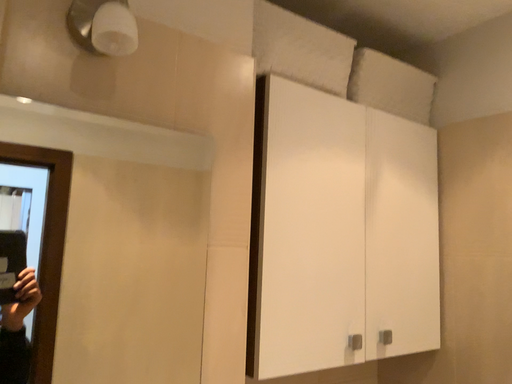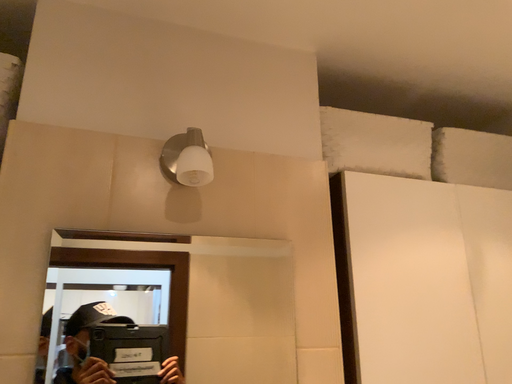
Question: How did the camera likely rotate when shooting the video?

Choices:
 (A) rotated downward
 (B) rotated upward

Answer: (B)